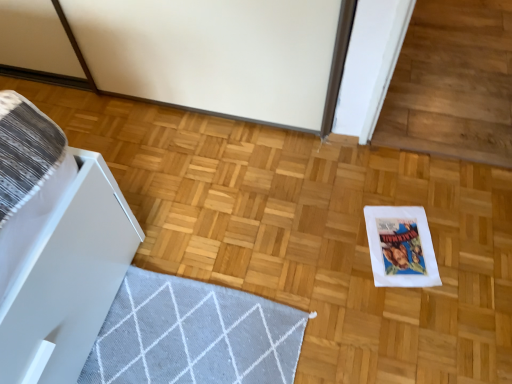
Locate an element on the screen. The width and height of the screenshot is (512, 384). vacant space underneath matte white comic book at lower right (from a real-world perspective) is located at coordinates (397, 249).